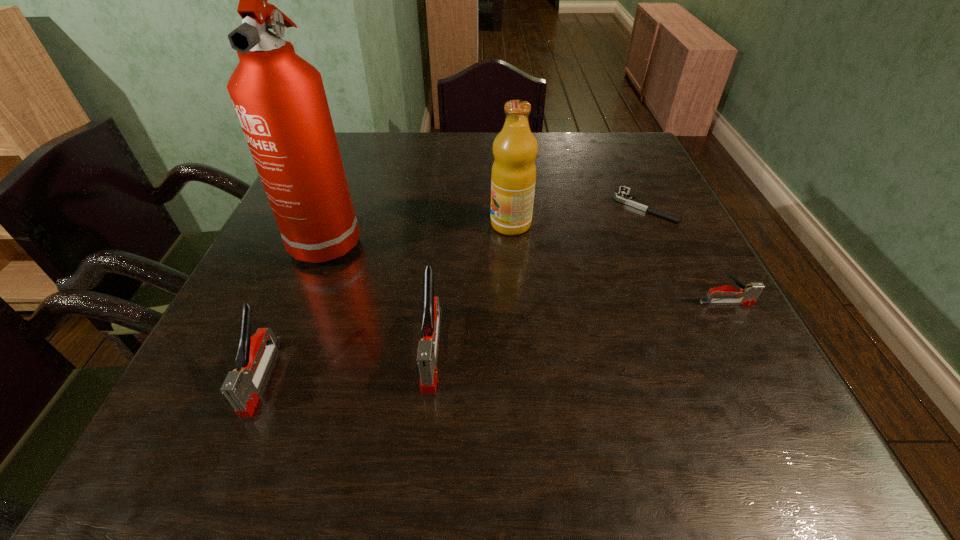
Locate an element on the screen. Image resolution: width=960 pixels, height=540 pixels. object that is at the near left corner is located at coordinates (242, 386).

Identify the location of free region at the far edge of the desktop. The image size is (960, 540). (462, 137).

In the image, there is a desktop. Identify the location of vacant space at the near edge. (673, 401).

I want to click on vacant space at the far right corner, so click(594, 148).

Locate an element on the screen. The height and width of the screenshot is (540, 960). free spot at the near right corner of the desktop is located at coordinates (728, 400).

The width and height of the screenshot is (960, 540). Identify the location of free space that is in between the shortest object and the second shortest stapler. (453, 291).

Where is `free spot between the third nearest object and the fifth shortest object`? free spot between the third nearest object and the fifth shortest object is located at coordinates (618, 264).

This screenshot has height=540, width=960. In order to click on unoccupied area between the pistol and the third object from left to right in this screenshot , I will do `click(539, 278)`.

You are a GUI agent. You are given a task and a screenshot of the screen. Output one action in this format:
    pyautogui.click(x=<x>, y=<y>)
    Task: Click on the empty location between the shortest stapler and the fifth shortest object
    This screenshot has height=540, width=960.
    Given the screenshot: What is the action you would take?
    pyautogui.click(x=618, y=264)

The height and width of the screenshot is (540, 960). I want to click on free space between the second stapler from right to left and the shortest object, so click(x=539, y=278).